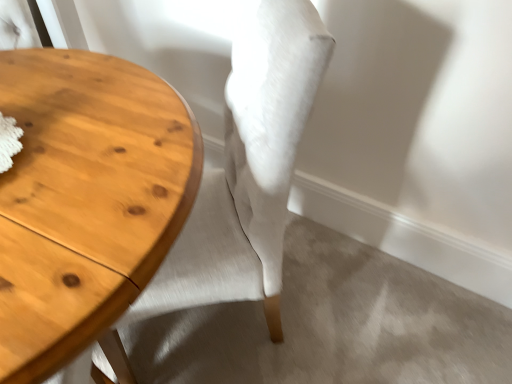
Question: Can you confirm if light brown wood table at left is bigger than light beige fabric chair at center?

Choices:
 (A) yes
 (B) no

Answer: (A)

Question: Is light brown wood table at left in front of light beige fabric chair at center?

Choices:
 (A) yes
 (B) no

Answer: (A)

Question: Is light brown wood table at left further to the viewer compared to light beige fabric chair at center?

Choices:
 (A) no
 (B) yes

Answer: (A)

Question: Is light brown wood table at left oriented towards light beige fabric chair at center?

Choices:
 (A) yes
 (B) no

Answer: (B)

Question: Is light beige fabric chair at center completely or partially inside light brown wood table at left?

Choices:
 (A) yes
 (B) no

Answer: (A)

Question: Is light brown wood table at left outside light beige fabric chair at center?

Choices:
 (A) no
 (B) yes

Answer: (B)

Question: Are light beige fabric chair at center and light brown wood table at left located far from each other?

Choices:
 (A) yes
 (B) no

Answer: (B)

Question: Considering the relative positions of light beige fabric chair at center and light brown wood table at left in the image provided, is light beige fabric chair at center to the left of light brown wood table at left from the viewer's perspective?

Choices:
 (A) yes
 (B) no

Answer: (B)

Question: From a real-world perspective, is light beige fabric chair at center under light brown wood table at left?

Choices:
 (A) no
 (B) yes

Answer: (A)

Question: Is light beige fabric chair at center located outside light brown wood table at left?

Choices:
 (A) no
 (B) yes

Answer: (A)

Question: Is light brown wood table at left inside light beige fabric chair at center?

Choices:
 (A) yes
 (B) no

Answer: (B)

Question: Does light beige fabric chair at center have a larger size compared to light brown wood table at left?

Choices:
 (A) no
 (B) yes

Answer: (A)

Question: Is light brown wood table at left in front of or behind light beige fabric chair at center in the image?

Choices:
 (A) front
 (B) behind

Answer: (A)